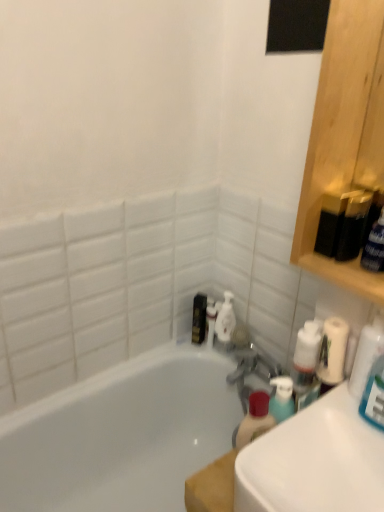
Question: Is white glossy sink at lower right positioned with its back to white glossy bathtub at center?

Choices:
 (A) yes
 (B) no

Answer: (B)

Question: From the image's perspective, is white glossy sink at lower right beneath white glossy bathtub at center?

Choices:
 (A) yes
 (B) no

Answer: (B)

Question: Is white glossy sink at lower right oriented towards white glossy bathtub at center?

Choices:
 (A) no
 (B) yes

Answer: (A)

Question: Does white glossy sink at lower right appear on the right side of white glossy bathtub at center?

Choices:
 (A) no
 (B) yes

Answer: (B)

Question: From a real-world perspective, is white glossy sink at lower right over white glossy bathtub at center?

Choices:
 (A) yes
 (B) no

Answer: (A)

Question: Considering the positions of white glossy sink at lower right and white glossy bottle at center in the image, is white glossy sink at lower right wider or thinner than white glossy bottle at center?

Choices:
 (A) thin
 (B) wide

Answer: (B)

Question: Relative to white glossy bottle at center, is white glossy sink at lower right in front or behind?

Choices:
 (A) behind
 (B) front

Answer: (B)

Question: Does point (357, 412) appear closer or farther from the camera than point (221, 324)?

Choices:
 (A) farther
 (B) closer

Answer: (B)

Question: Is white glossy sink at lower right situated inside white glossy bottle at center or outside?

Choices:
 (A) outside
 (B) inside

Answer: (A)

Question: Relative to white glossy bathtub at center, is white glossy bottle at center in front or behind?

Choices:
 (A) behind
 (B) front

Answer: (A)

Question: From a real-world perspective, is white glossy bottle at center above or below white glossy bathtub at center?

Choices:
 (A) below
 (B) above

Answer: (B)

Question: Would you say white glossy bottle at center is inside or outside white glossy bathtub at center?

Choices:
 (A) inside
 (B) outside

Answer: (B)

Question: Considering the positions of white glossy bottle at center and white glossy bathtub at center in the image, is white glossy bottle at center bigger or smaller than white glossy bathtub at center?

Choices:
 (A) small
 (B) big

Answer: (A)

Question: From the image's perspective, relative to white glossy bathtub at center, is metallic gold toiletry at center, which is counted as the first toiletry, starting from the left, above or below?

Choices:
 (A) below
 (B) above

Answer: (B)

Question: Is metallic gold toiletry at center, acting as the second toiletry starting from the right, taller or shorter than white glossy bathtub at center?

Choices:
 (A) tall
 (B) short

Answer: (B)